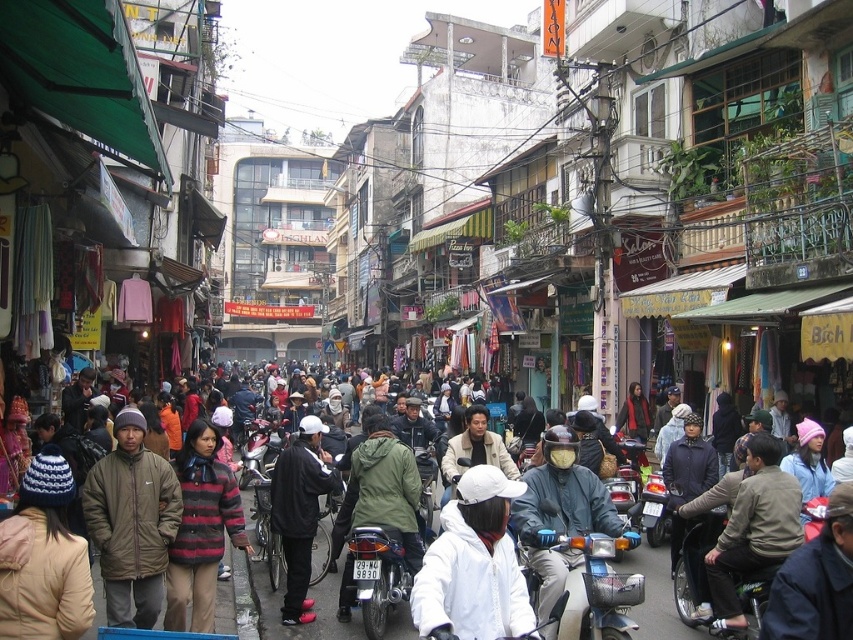
Question: Does matte black helmet at center appear on the right side of white matte jacket at center?

Choices:
 (A) no
 (B) yes

Answer: (B)

Question: Is white matte jacket at center further to camera compared to black matte jacket at center?

Choices:
 (A) no
 (B) yes

Answer: (A)

Question: Which of the following is the farthest from the observer?

Choices:
 (A) metallic silver motorcycle at center
 (B) striped woolen sweater at center

Answer: (A)

Question: Among these objects, which one is nearest to the camera?

Choices:
 (A) dark olive-green jacket at center-left
 (B) striped woolen sweater at center
 (C) metallic silver motorcycle at center
 (D) matte black helmet at center

Answer: (D)

Question: Estimate the real-world distances between objects in this image. Which object is farther from the matte black helmet at center?

Choices:
 (A) metallic silver motorcycle at center
 (B) white knit hat at center
 (C) green matte jacket at center

Answer: (A)

Question: Does matte black helmet at center have a greater width compared to white knit hat at center?

Choices:
 (A) no
 (B) yes

Answer: (B)